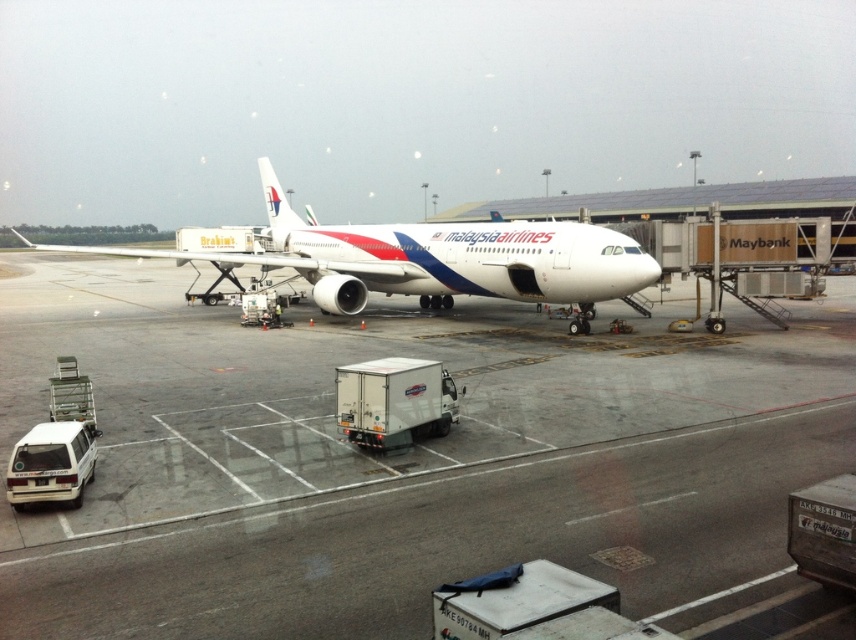
Question: Is the position of white glossy tarmac at center less distant than that of white glossy airplane at center?

Choices:
 (A) yes
 (B) no

Answer: (A)

Question: Which point is closer to the camera?

Choices:
 (A) white glossy tarmac at center
 (B) white glossy airplane at center

Answer: (A)

Question: Is the position of white glossy tarmac at center less distant than that of white glossy airplane at center?

Choices:
 (A) no
 (B) yes

Answer: (B)

Question: Can you confirm if white glossy tarmac at center is wider than white glossy airplane at center?

Choices:
 (A) no
 (B) yes

Answer: (A)